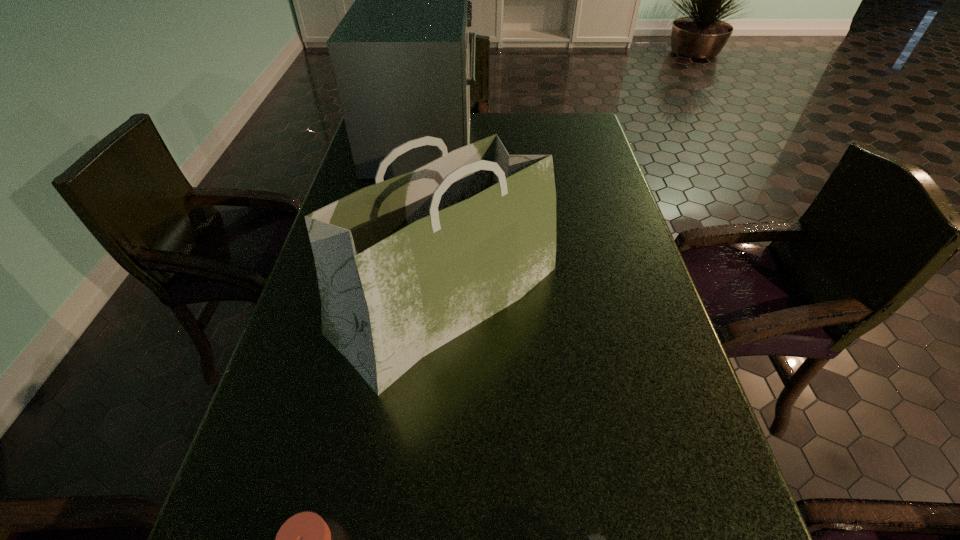
Where is `blank space at the right edge`? The width and height of the screenshot is (960, 540). blank space at the right edge is located at coordinates (608, 383).

Image resolution: width=960 pixels, height=540 pixels. What are the coordinates of `free space at the far right corner` in the screenshot? It's located at (565, 120).

Identify which object is located as the nearest to the grocery bag. Please provide its 2D coordinates. Your answer should be formatted as a tuple, i.e. [(x, y)], where the tuple contains the x and y coordinates of a point satisfying the conditions above.

[(400, 56)]

Select which object is the closest to the farthest object. Please provide its 2D coordinates. Your answer should be formatted as a tuple, i.e. [(x, y)], where the tuple contains the x and y coordinates of a point satisfying the conditions above.

[(405, 265)]

Where is `free space in the image that satisfies the following two spatial constraints: 1. on the front panel of the toaster oven; 2. on the back side of the second farthest object`? free space in the image that satisfies the following two spatial constraints: 1. on the front panel of the toaster oven; 2. on the back side of the second farthest object is located at coordinates (396, 300).

Where is `free space in the image that satisfies the following two spatial constraints: 1. on the front panel of the grocery bag; 2. on the right side of the toaster oven`? The width and height of the screenshot is (960, 540). free space in the image that satisfies the following two spatial constraints: 1. on the front panel of the grocery bag; 2. on the right side of the toaster oven is located at coordinates (396, 300).